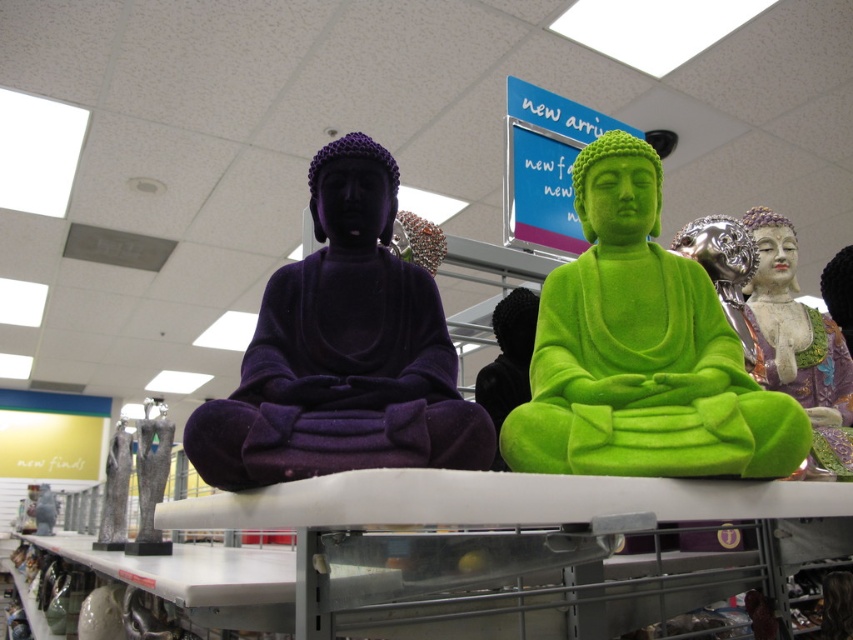
Consider the image. You are a customer in the store and want to pick up an item located at point (x=363, y=289) and another item at point (x=107, y=484). Which item should you reach for first to minimize bending or stretching?

You should reach for the item at point (x=363, y=289) first because it is closer to you than the item at point (x=107, y=484), requiring less bending or stretching.

You are a store employee who needs to rearrange the display shelf. If you want to place a new decorative item between the green fuzzy buddha at center and the gray marble statue at lower left, will there be enough space? Explain your reasoning based on their sizes.

The green fuzzy buddha at center occupies less space than the gray marble statue at lower left. Since the green fuzzy buddha is smaller, there should be sufficient space between them to place a new decorative item.